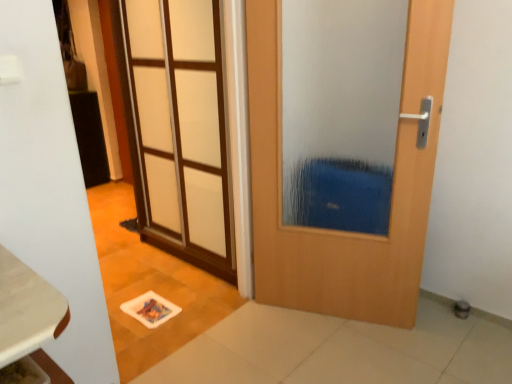
Locate an element on the screen. This screenshot has height=384, width=512. vacant space situated above wooden table at lower left (from a real-world perspective) is located at coordinates (14, 291).